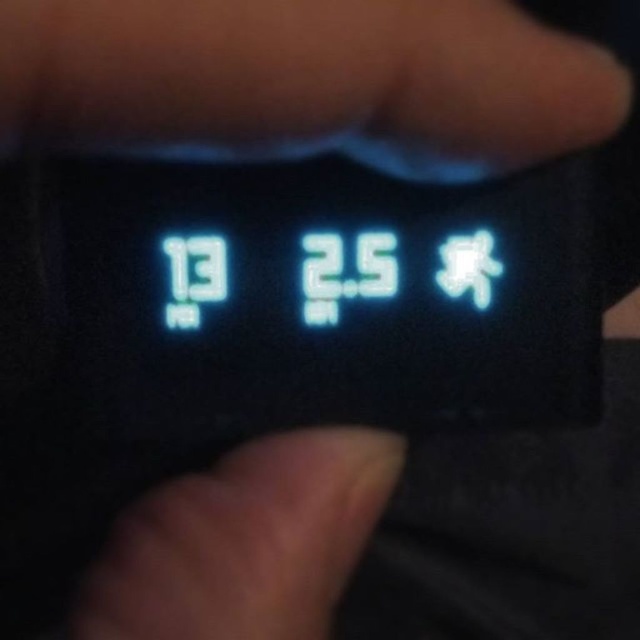
Question: Does black matte hand at upper center appear on the left side of smooth skin at center?

Choices:
 (A) no
 (B) yes

Answer: (A)

Question: Which of the following is the farthest from the observer?

Choices:
 (A) smooth skin at center
 (B) black matte hand at upper center

Answer: (A)

Question: Among these objects, which one is nearest to the camera?

Choices:
 (A) black matte hand at upper center
 (B) smooth skin at center

Answer: (A)

Question: Where is black matte hand at upper center located in relation to smooth skin at center in the image?

Choices:
 (A) left
 (B) right

Answer: (B)

Question: From the image, what is the correct spatial relationship of black matte hand at upper center in relation to smooth skin at center?

Choices:
 (A) below
 (B) above

Answer: (B)